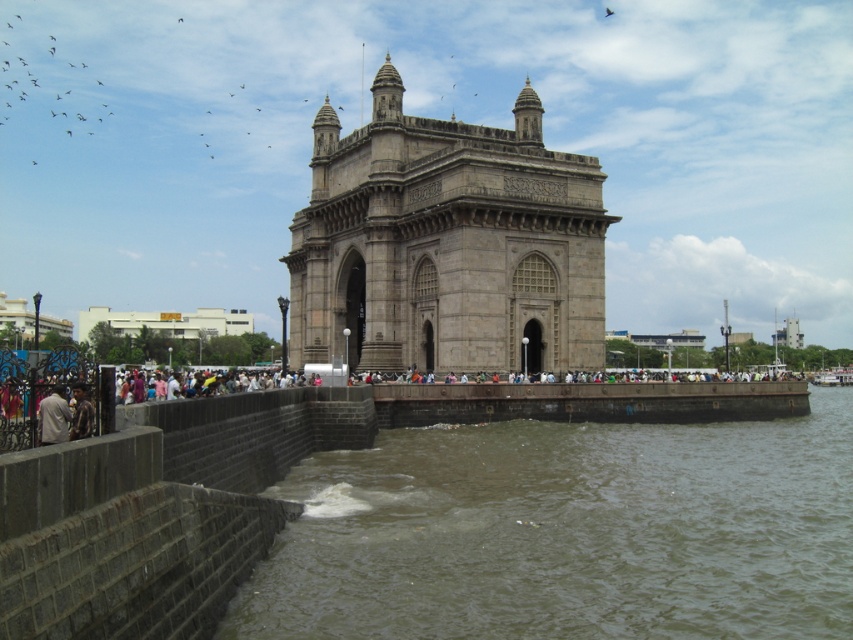
Is brown concrete river at lower center thinner than light brown fabric jacket at lower left?

No.

Measure the distance between brown concrete river at lower center and light brown fabric jacket at lower left.

27.56 meters

Describe the element at coordinates (567, 532) in the screenshot. I see `brown concrete river at lower center` at that location.

At what (x,y) coordinates should I click in order to perform the action: click on brown concrete river at lower center. Please return your answer as a coordinate pair (x, y). The height and width of the screenshot is (640, 853). Looking at the image, I should click on [567, 532].

Can you confirm if brown concrete river at lower center is taller than gray stone gateway of india at center?

No.

Is brown concrete river at lower center in front of gray stone gateway of india at center?

Yes, it is.

Who is more forward, (714,502) or (532,108)?

Point (714,502) is in front.

I want to click on brown concrete river at lower center, so click(567, 532).

Between brown concrete river at lower center and dark brown leather jacket at lower left, which one appears on the right side from the viewer's perspective?

Positioned to the right is brown concrete river at lower center.

Who is higher up, brown concrete river at lower center or dark brown leather jacket at lower left?

Positioned higher is dark brown leather jacket at lower left.

I want to click on brown concrete river at lower center, so click(567, 532).